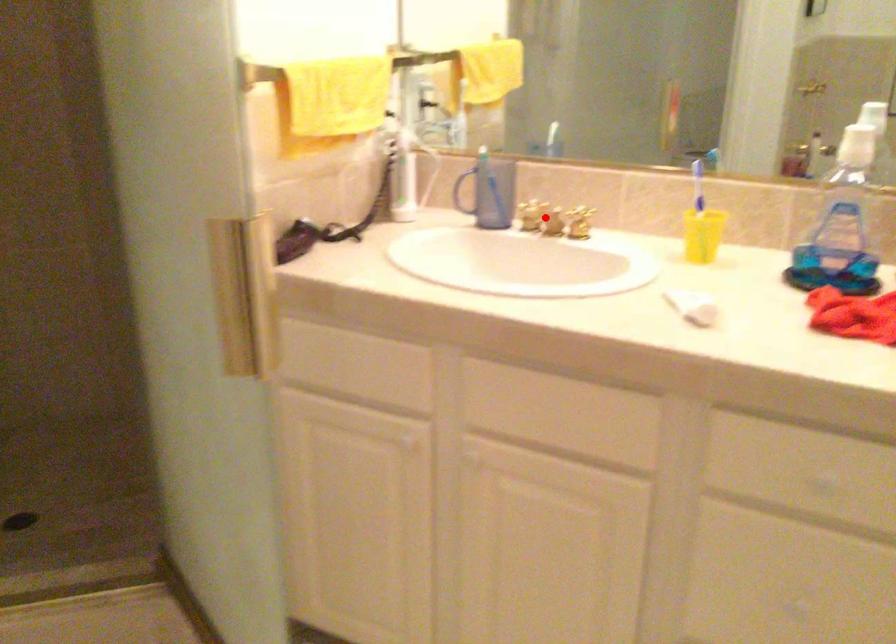
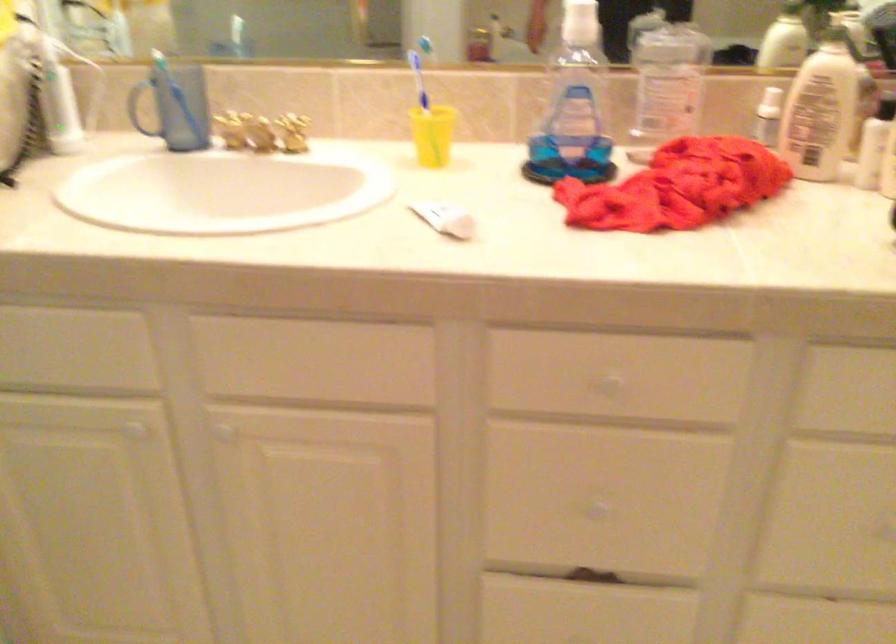
Find the pixel in the second image that matches the highlighted location in the first image.

(259, 131)